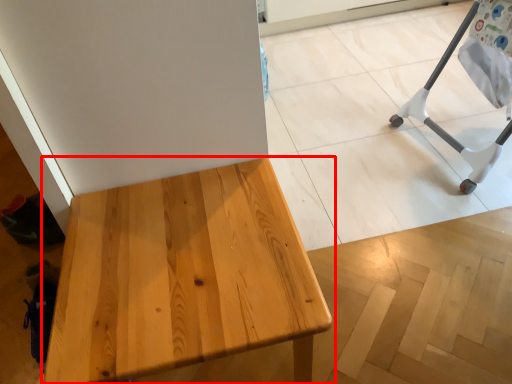
Question: From the image's perspective, what is the correct spatial positioning of table (annotated by the red box) in reference to furniture?

Choices:
 (A) below
 (B) above

Answer: (A)